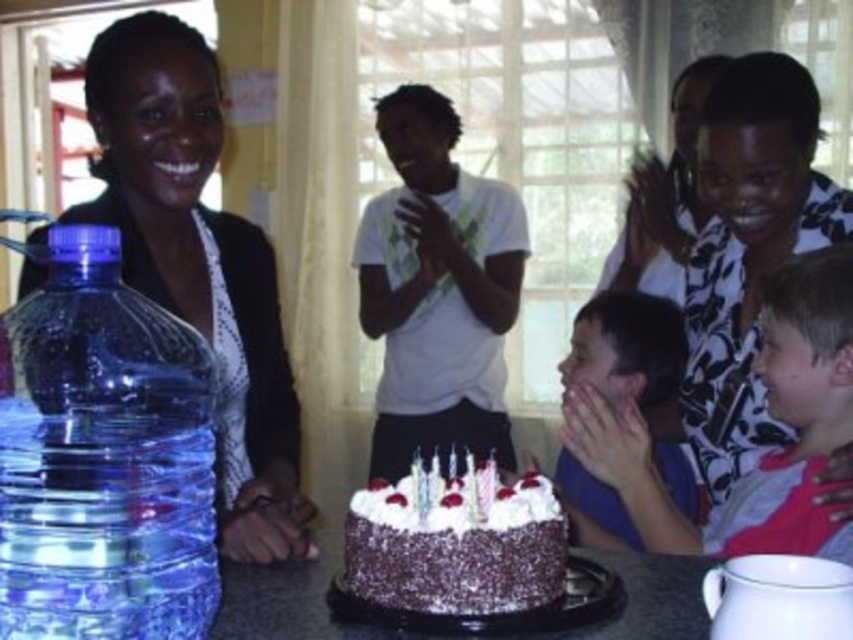
You are standing in the room and want to take a photo of the white floral shirt at upper right. Where should you look to capture it in your camera viewfinder?

To capture the white floral shirt at upper right in your camera viewfinder, aim your camera towards the position at point coordinates 0.391 on the horizontal axis and 0.878 on the vertical axis, as that is where the white floral shirt at upper right is located.

You are a photographer at the birthday party and need to capture a clear photo of both the transparent plastic bottle at left and the smooth skin child at lower right. However, the bottle is currently blocking the child. Can you adjust your position to ensure the child is fully visible without moving any objects?

The transparent plastic bottle at left is positioned over smooth skin child at lower right. To capture the child fully, you can move your camera position to the right side so the bottle no longer obscures the child.

You are a guest at the birthday party and want to blow out the candles on the chocolate frosted cake at center. However, there is a white floral shirt at upper right in your line of sight. Can you see the cake clearly to blow out the candles?

The chocolate frosted cake at center is behind the white floral shirt at upper right, so you cannot see the cake clearly to blow out the candles.